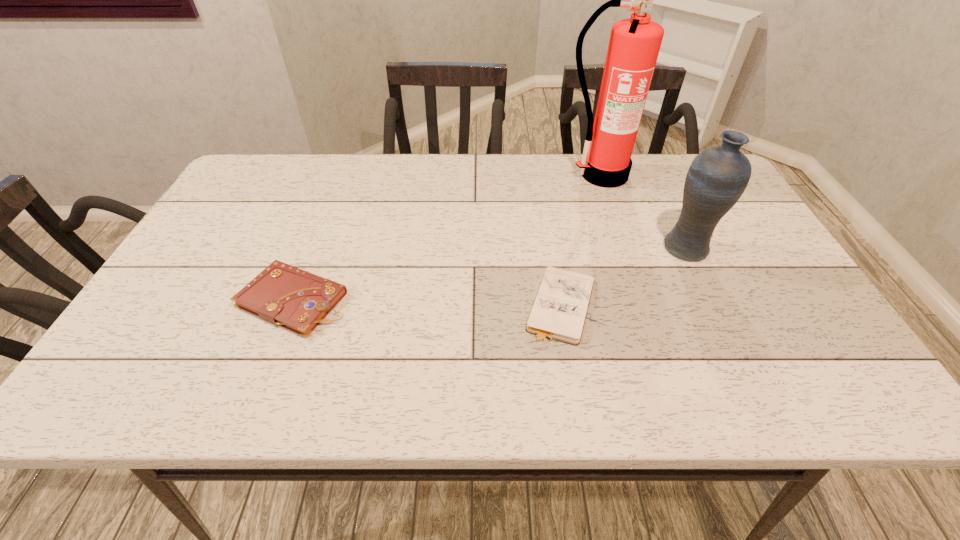
The width and height of the screenshot is (960, 540). In order to click on object that is the third closest one to the tallest object in this screenshot , I will do `click(284, 295)`.

At what (x,y) coordinates should I click in order to perform the action: click on object that stands as the second closest to the shorter notebook. Please return your answer as a coordinate pair (x, y). The image size is (960, 540). Looking at the image, I should click on (634, 45).

This screenshot has height=540, width=960. Find the location of `blank area in the image that satisfies the following two spatial constraints: 1. on the back side of the vase; 2. on the right side of the second shortest object`. blank area in the image that satisfies the following two spatial constraints: 1. on the back side of the vase; 2. on the right side of the second shortest object is located at coordinates [314, 248].

The image size is (960, 540). What are the coordinates of `vacant position in the image that satisfies the following two spatial constraints: 1. with the nozzle aimed from the tallest object; 2. on the right side of the third shortest object` in the screenshot? It's located at (627, 248).

This screenshot has width=960, height=540. Find the location of `vacant position in the image that satisfies the following two spatial constraints: 1. with the nozzle aimed from the tallest object; 2. on the right side of the second farthest object`. vacant position in the image that satisfies the following two spatial constraints: 1. with the nozzle aimed from the tallest object; 2. on the right side of the second farthest object is located at coordinates (627, 248).